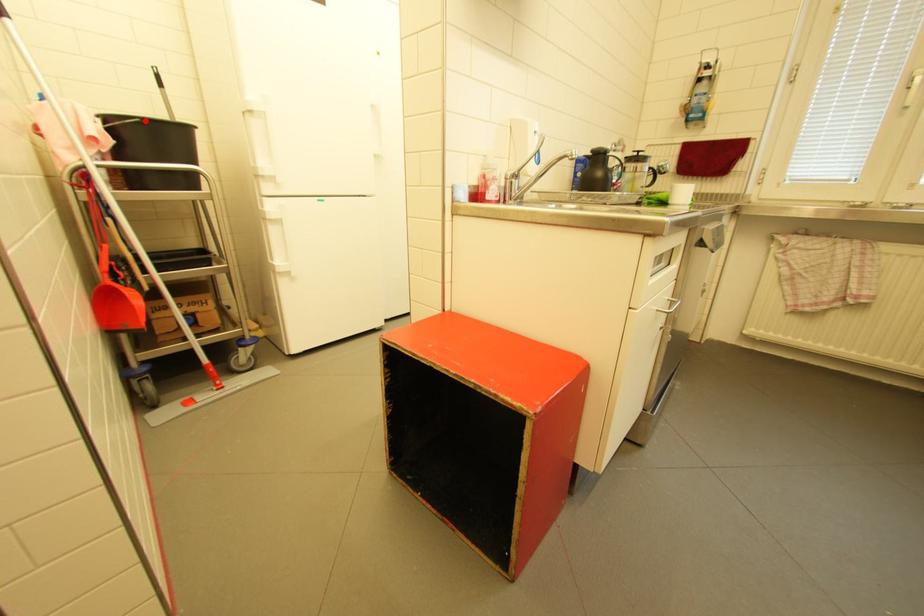
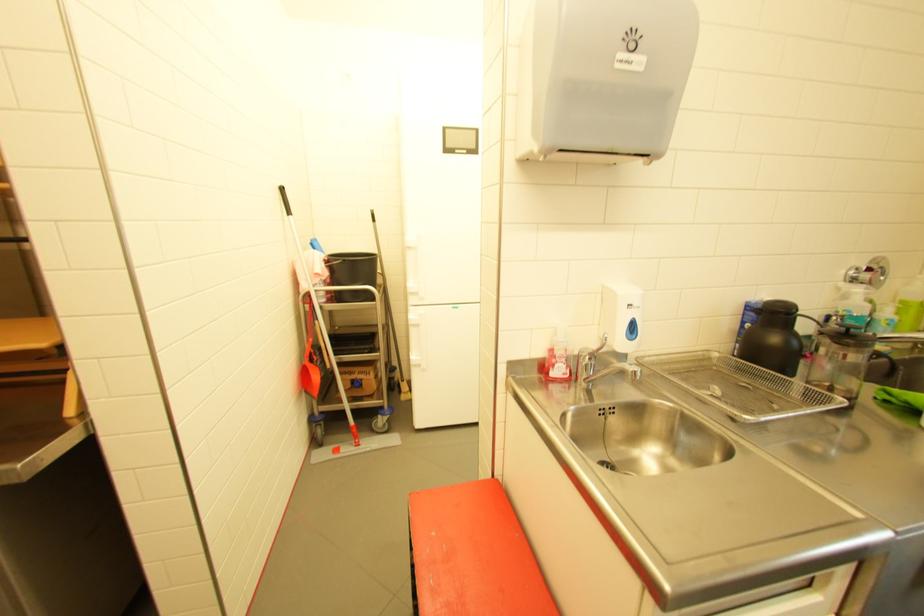
Question: I am providing you with two images of the same scene from different viewpoints. Image1 has a red point marked. In image2, the corresponding 3D location appears at what relative position? Reply with the corresponding letter.

Choices:
 (A) Closer
 (B) Farther

Answer: (A)